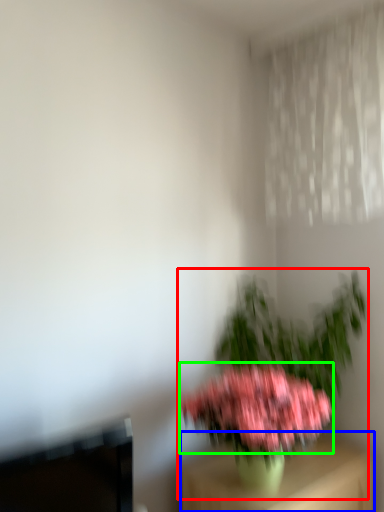
Question: Which object is positioned farthest from houseplant (highlighted by a red box)? Select from furniture (highlighted by a blue box) and flower (highlighted by a green box).

Choices:
 (A) furniture
 (B) flower

Answer: (B)